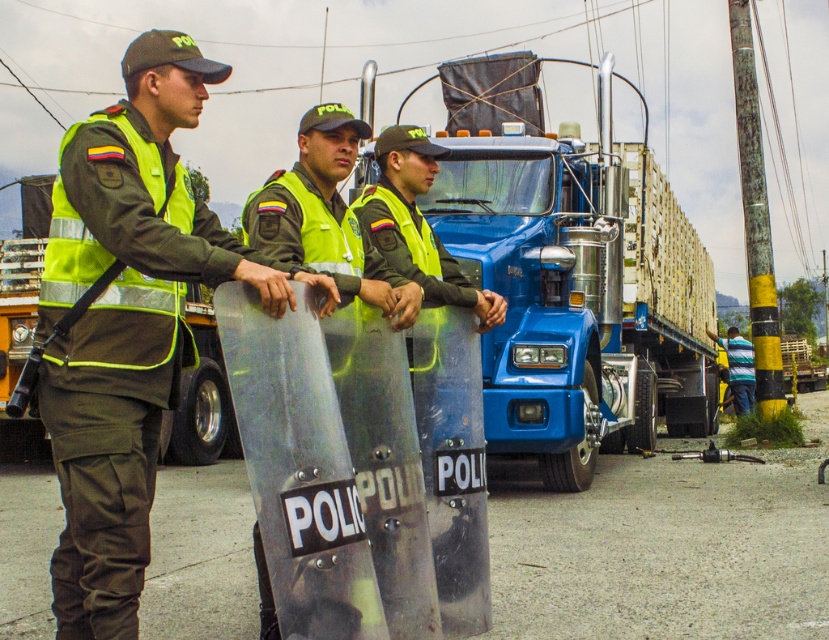
Question: Is blue metallic truck at center wider than striped cotton shirt at lower right?

Choices:
 (A) no
 (B) yes

Answer: (B)

Question: Is green matte uniform at left smaller than striped cotton shirt at lower right?

Choices:
 (A) no
 (B) yes

Answer: (B)

Question: Can you confirm if blue metallic truck at center is thinner than green matte uniform at left?

Choices:
 (A) no
 (B) yes

Answer: (A)

Question: Which point appears farthest from the camera in this image?

Choices:
 (A) (612, 179)
 (B) (128, 580)
 (C) (745, 412)

Answer: (C)

Question: Estimate the real-world distances between objects in this image. Which object is farther from the green matte uniform at left?

Choices:
 (A) metallic silver shield at center
 (B) green reflective vest at center
 (C) blue metallic truck at center
 (D) striped cotton shirt at lower right

Answer: (D)

Question: Estimate the real-world distances between objects in this image. Which object is closer to the green matte uniform at left?

Choices:
 (A) striped cotton shirt at lower right
 (B) metallic silver shield at center

Answer: (B)